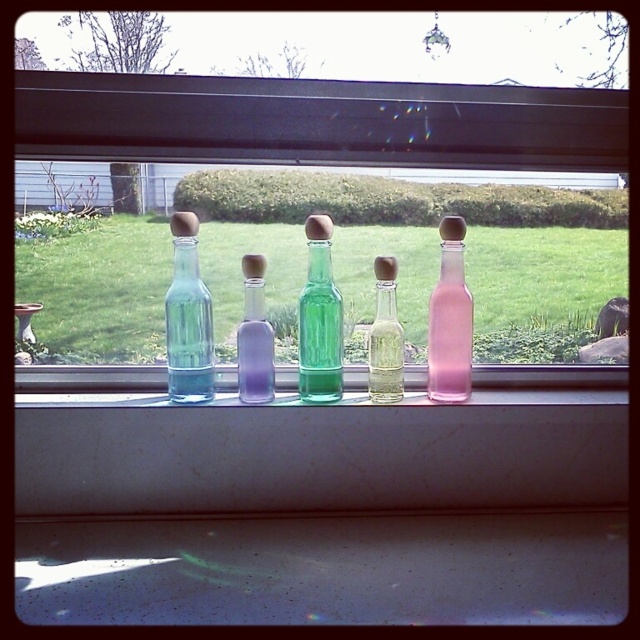
Is point (157, 60) farther from camera compared to point (186, 353)?

Yes, it is.

Between point (216, 147) and point (173, 388), which one is positioned behind?

The point (216, 147) is more distant.

Image resolution: width=640 pixels, height=640 pixels. I want to click on transparent glass bottles at center, so click(x=321, y=184).

What do you see at coordinates (320, 317) in the screenshot? I see `green glass bottle at center` at bounding box center [320, 317].

How much distance is there between green glass bottle at center and translucent glass bottle at center?

green glass bottle at center and translucent glass bottle at center are 4.61 centimeters apart.

Who is more distant from viewer, (333, 380) or (381, 291)?

The point (333, 380) is behind.

Where is `green glass bottle at center`? green glass bottle at center is located at coordinates (320, 317).

What do you see at coordinates (188, 317) in the screenshot? I see `transparent glass bottle at center` at bounding box center [188, 317].

Between transparent glass bottle at center and translucent glass bottle at center, which one is positioned lower?

translucent glass bottle at center

Who is more forward, (188, 253) or (392, 348)?

Point (188, 253) is in front.

Identify the location of transparent glass bottle at center. (188, 317).